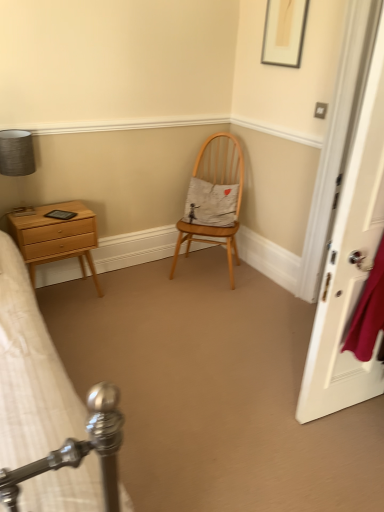
Question: Which is correct: light wood chair at center is inside light brown wood nightstand at left, or outside of it?

Choices:
 (A) inside
 (B) outside

Answer: (B)

Question: Based on their positions, is light wood chair at center located to the left or right of light brown wood nightstand at left?

Choices:
 (A) right
 (B) left

Answer: (A)

Question: Based on their relative distances, which object is nearer to the white wooden door at right?

Choices:
 (A) matte gold picture frame at upper center
 (B) matte gray lampshade at upper left
 (C) light wood chair at center
 (D) light brown wood nightstand at left

Answer: (A)

Question: Which of these objects is positioned closest to the white wooden door at right?

Choices:
 (A) light wood chair at center
 (B) matte gray lampshade at upper left
 (C) matte gold picture frame at upper center
 (D) light brown wood nightstand at left

Answer: (C)